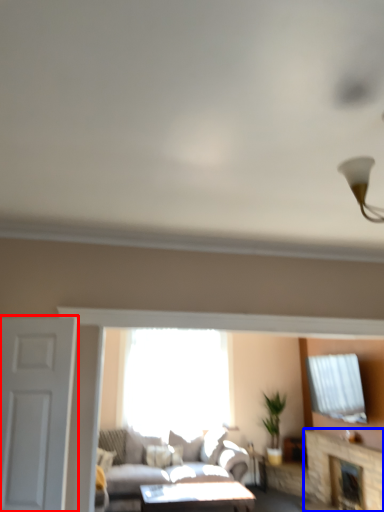
Question: Which of the following is the farthest to the observer, door (highlighted by a red box) or fireplace (highlighted by a blue box)?

Choices:
 (A) door
 (B) fireplace

Answer: (B)